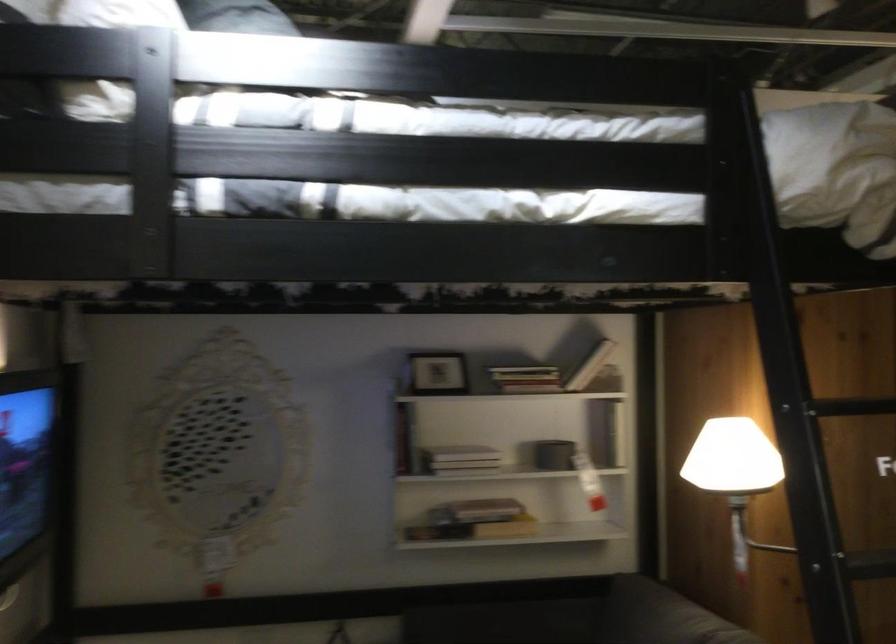
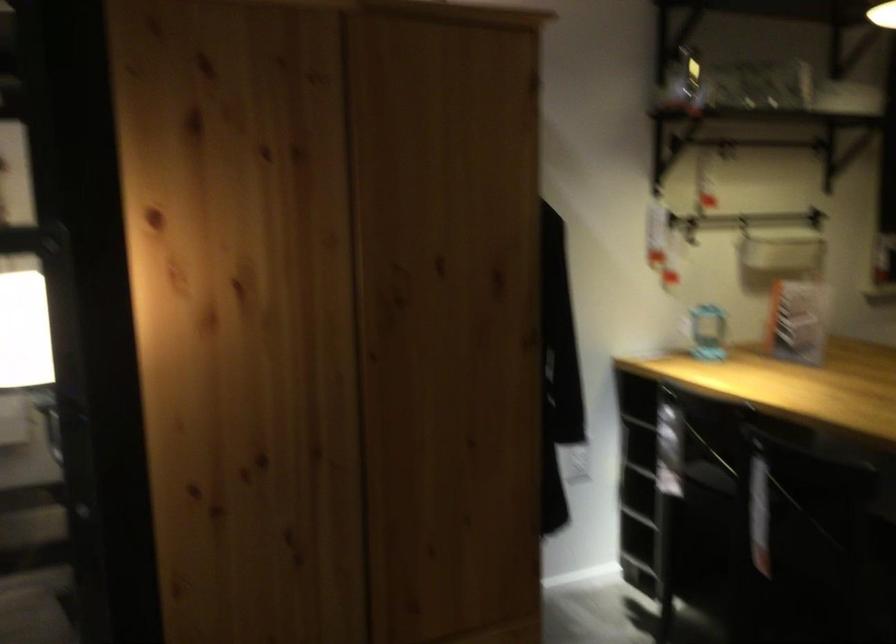
The images are taken continuously from a first-person perspective. In which direction are you moving?

The movement direction of the cameraman is right, forward.